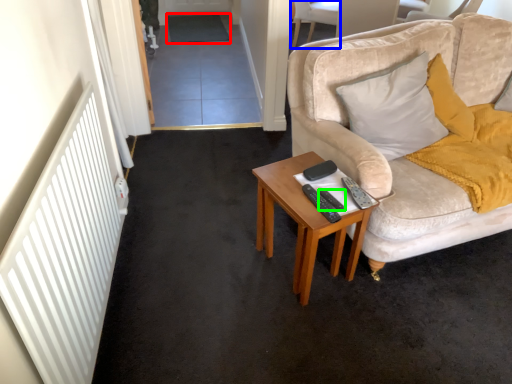
Question: Estimate the real-world distances between objects in this image. Which object is closer to plain (highlighted by a red box), chair (highlighted by a blue box) or remote control (highlighted by a green box)?

Choices:
 (A) chair
 (B) remote control

Answer: (A)